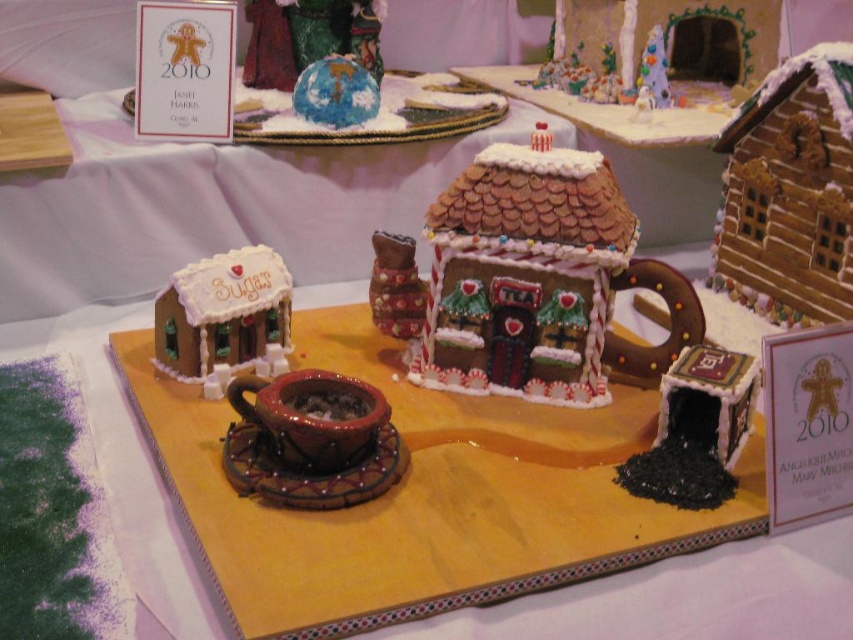
Question: Estimate the real-world distances between objects in this image. Which object is closer to the glazed gingerbread house at center?

Choices:
 (A) white sugary house at lower left
 (B) matte brown gingerbread house at center

Answer: (B)

Question: Does glazed gingerbread house at center have a lesser width compared to matte brown gingerbread house at center?

Choices:
 (A) yes
 (B) no

Answer: (B)

Question: Which object is positioned farthest from the white sugary house at lower left?

Choices:
 (A) glazed gingerbread house at center
 (B) matte brown gingerbread house at center

Answer: (A)

Question: Does glazed gingerbread house at center appear over white sugary house at lower left?

Choices:
 (A) yes
 (B) no

Answer: (A)

Question: Can you confirm if glazed gingerbread house at center is positioned to the right of matte brown gingerbread house at center?

Choices:
 (A) no
 (B) yes

Answer: (B)

Question: Which point is farther from the camera taking this photo?

Choices:
 (A) (389, 288)
 (B) (494, 177)
 (C) (199, 317)

Answer: (A)